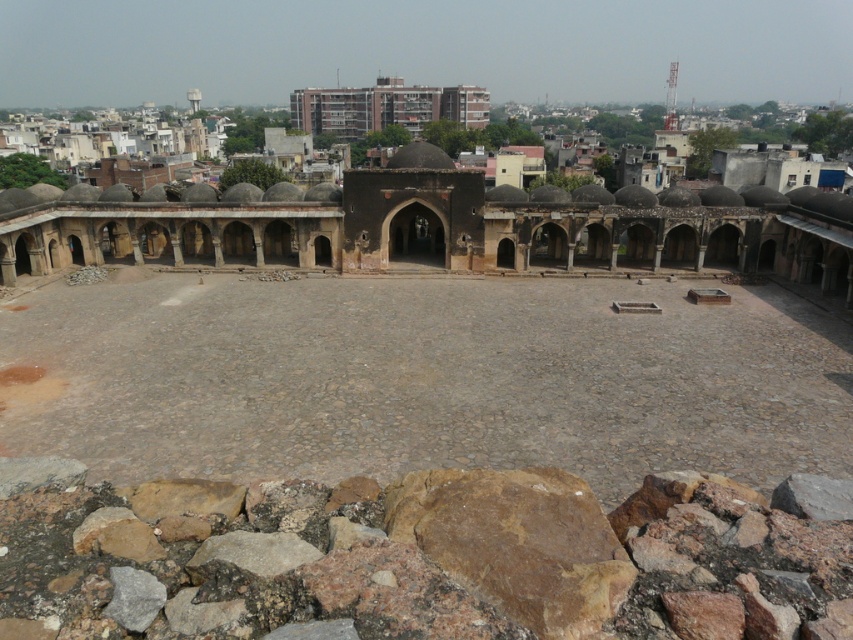
Is point (244, 580) in front of point (419, 93)?

Yes, it is in front of point (419, 93).

Is point (334, 612) positioned behind point (373, 109)?

No.

Does point (804, 538) lie behind point (300, 92)?

No, it is in front of (300, 92).

You are a GUI agent. You are given a task and a screenshot of the screen. Output one action in this format:
    pyautogui.click(x=<x>, y=<y>)
    Task: Click on the brown rough rock at lower center
    The width and height of the screenshot is (853, 640).
    Given the screenshot: What is the action you would take?
    pyautogui.click(x=416, y=557)

Which of these two, gray stone courtyard at center or dark brown stone amphitheater at center, stands shorter?

With less height is gray stone courtyard at center.

Which is above, gray stone courtyard at center or dark brown stone amphitheater at center?

dark brown stone amphitheater at center is higher up.

Who is more forward, (x=0, y=452) or (x=148, y=252)?

Point (x=0, y=452)

Where is `gray stone courtyard at center`? This screenshot has width=853, height=640. gray stone courtyard at center is located at coordinates pyautogui.click(x=428, y=378).

Locate an element on the screen. brown rough rock at lower center is located at coordinates (416, 557).

Who is more forward, (766, 529) or (119, 225)?

Point (766, 529) is in front.

Which is behind, point (512, 497) or point (474, 230)?

The point (474, 230) is more distant.

At what (x,y) coordinates should I click in order to perform the action: click on brown rough rock at lower center. Please return your answer as a coordinate pair (x, y). The height and width of the screenshot is (640, 853). Looking at the image, I should click on (416, 557).